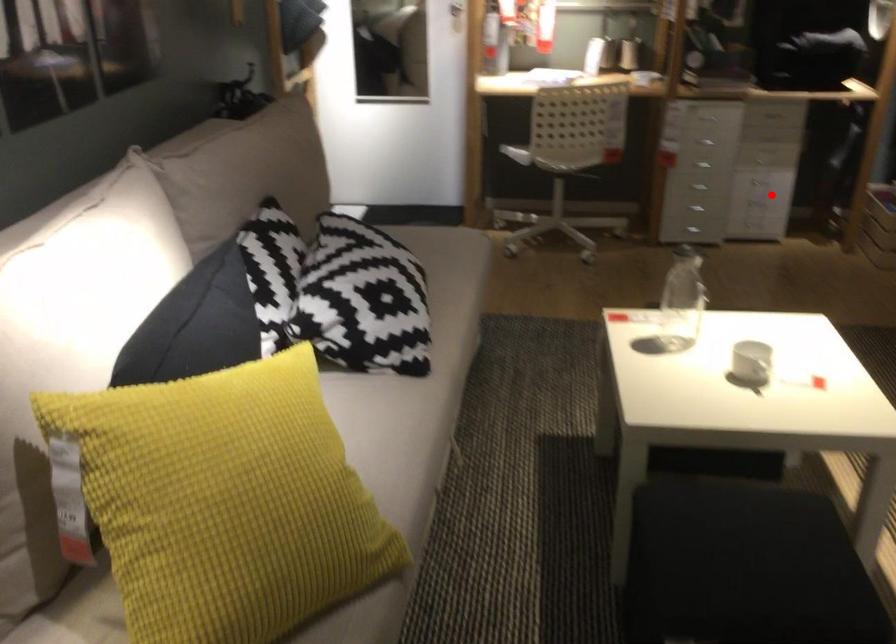
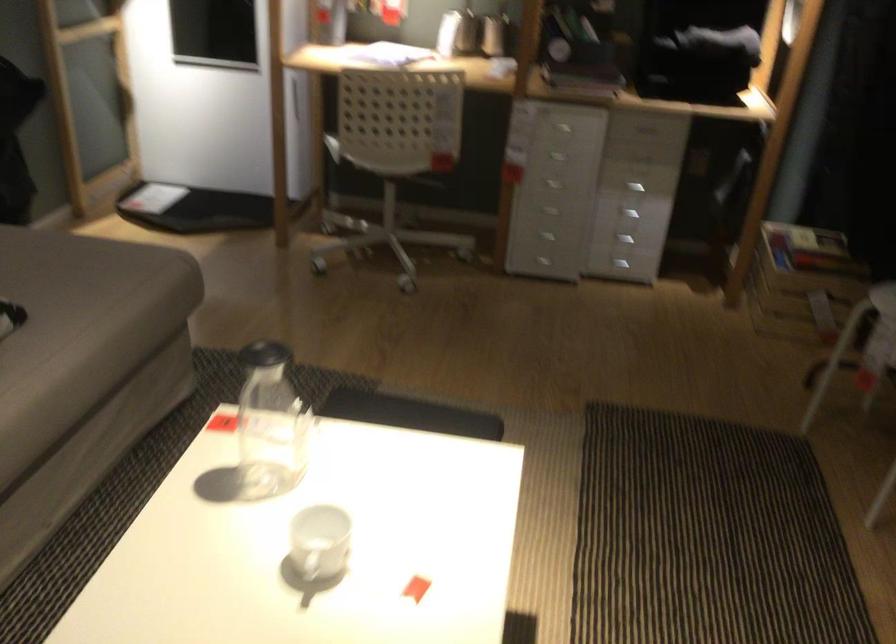
Question: I am providing you with two images of the same scene from different viewpoints. Given a red point in image1, look at the same physical point in image2. Is it:

Choices:
 (A) Closer to the viewpoint
 (B) Farther from the viewpoint

Answer: (A)